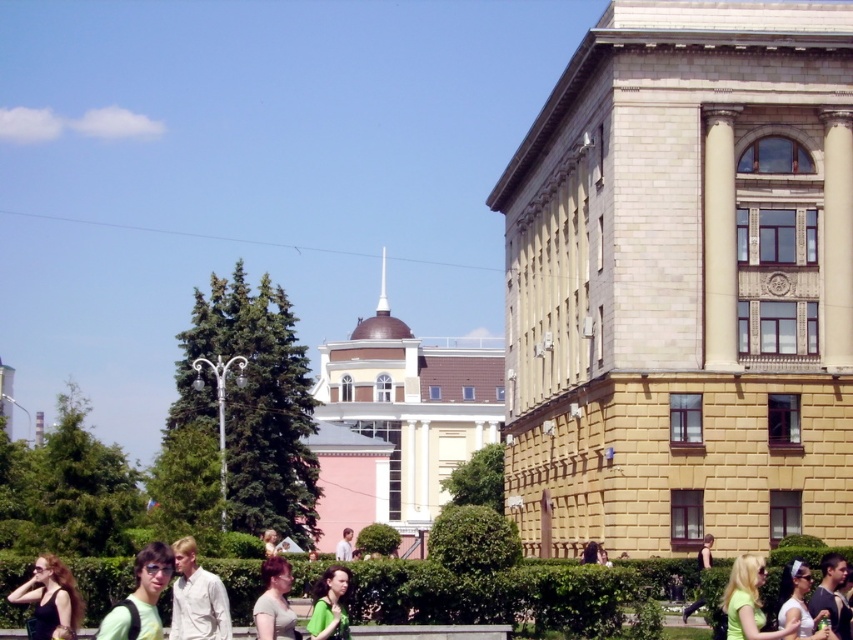
You are standing at the edge of the path and see the green leafy hedge at center and the matte black dress at lower left. Which object is closer to your left side?

The matte black dress at lower left is closer to your left side because it is positioned to the left of the green leafy hedge at center.

You are a photographer standing on the path and want to take a photo of the green leafy hedge at center and the light beige shirt at lower left. Which object should you focus on first if you want to capture both in sharp focus?

The green leafy hedge at center is below the light beige shirt at lower left, so you should focus on the light beige shirt at lower left first since it is closer to you.

From the picture: You are a photographer trying to capture a photo of the matte black dress at lower left without including the green leafy hedge at center in the frame. Based on their positions, is this possible?

The green leafy hedge at center is below the matte black dress at lower left, so the dress is positioned higher up. Since the hedge is below the dress, you can adjust your camera angle to focus on the dress without including the hedge in the shot.